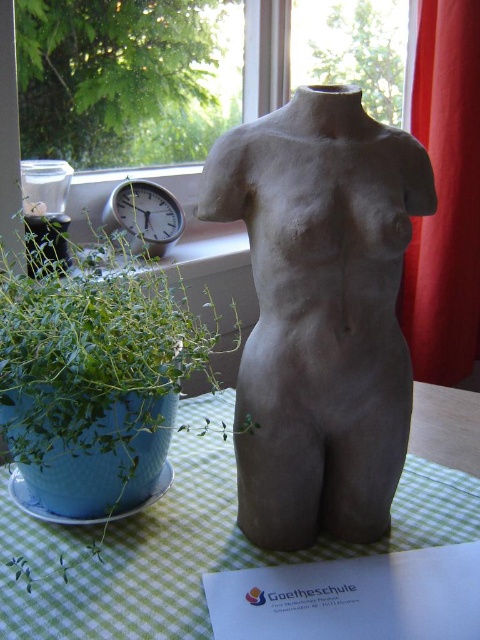
Based on the photo, you are arranging items on a table and need to place a vase between the green matte plant at left and the silver metallic clock at left. Based on their current positions, which item should the vase be placed to the right of?

The vase should be placed to the right of the silver metallic clock at left because the green matte plant at left is positioned on the right side of the silver metallic clock at left, meaning the clock is to the left of the plant. Therefore, placing the vase to the right of the clock would place it between the two items.

You are standing in front of the sculpture on the checkered tablecloth. Where is the green matte plant at left located in relation to the sculpture?

The green matte plant at left is located to the left of the sculpture.